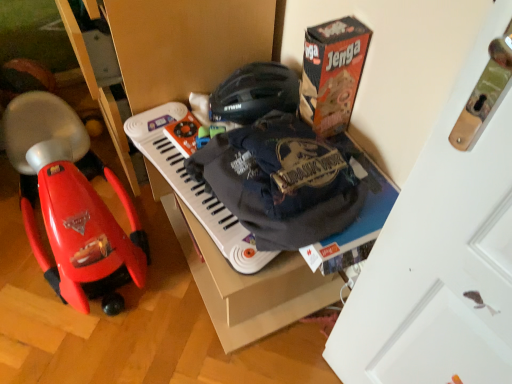
Question: Considering the relative sizes of white plastic musical keyboard at center and shiny red plastic baby carriage at left in the image provided, is white plastic musical keyboard at center bigger than shiny red plastic baby carriage at left?

Choices:
 (A) no
 (B) yes

Answer: (A)

Question: Considering the relative sizes of white plastic musical keyboard at center and shiny red plastic baby carriage at left in the image provided, is white plastic musical keyboard at center taller than shiny red plastic baby carriage at left?

Choices:
 (A) yes
 (B) no

Answer: (B)

Question: From the image's perspective, would you say white plastic musical keyboard at center is positioned over shiny red plastic baby carriage at left?

Choices:
 (A) yes
 (B) no

Answer: (B)

Question: Can you see white plastic musical keyboard at center touching shiny red plastic baby carriage at left?

Choices:
 (A) yes
 (B) no

Answer: (B)

Question: Considering the relative sizes of white plastic musical keyboard at center and shiny red plastic baby carriage at left in the image provided, is white plastic musical keyboard at center wider than shiny red plastic baby carriage at left?

Choices:
 (A) yes
 (B) no

Answer: (B)

Question: Looking at their shapes, would you say orange cardboard jenga box at upper right is wider or thinner than white plastic musical keyboard at center?

Choices:
 (A) thin
 (B) wide

Answer: (A)

Question: In the image, is orange cardboard jenga box at upper right positioned in front of or behind white plastic musical keyboard at center?

Choices:
 (A) front
 (B) behind

Answer: (A)

Question: From the image's perspective, relative to white plastic musical keyboard at center, is orange cardboard jenga box at upper right above or below?

Choices:
 (A) below
 (B) above

Answer: (B)

Question: From a real-world perspective, is orange cardboard jenga box at upper right above or below white plastic musical keyboard at center?

Choices:
 (A) above
 (B) below

Answer: (A)

Question: Considering the positions of shiny red plastic baby carriage at left and white plastic musical keyboard at center in the image, is shiny red plastic baby carriage at left bigger or smaller than white plastic musical keyboard at center?

Choices:
 (A) small
 (B) big

Answer: (B)

Question: Considering the positions of shiny red plastic baby carriage at left and white plastic musical keyboard at center in the image, is shiny red plastic baby carriage at left wider or thinner than white plastic musical keyboard at center?

Choices:
 (A) thin
 (B) wide

Answer: (B)

Question: Relative to white plastic musical keyboard at center, is shiny red plastic baby carriage at left in front or behind?

Choices:
 (A) front
 (B) behind

Answer: (A)

Question: Considering the relative positions of shiny red plastic baby carriage at left and white plastic musical keyboard at center in the image provided, is shiny red plastic baby carriage at left to the left or to the right of white plastic musical keyboard at center?

Choices:
 (A) right
 (B) left

Answer: (B)

Question: Would you say white matte door at upper right is to the left or to the right of white plastic musical keyboard at center in the picture?

Choices:
 (A) right
 (B) left

Answer: (A)

Question: From a real-world perspective, is white matte door at upper right physically located above or below white plastic musical keyboard at center?

Choices:
 (A) below
 (B) above

Answer: (B)